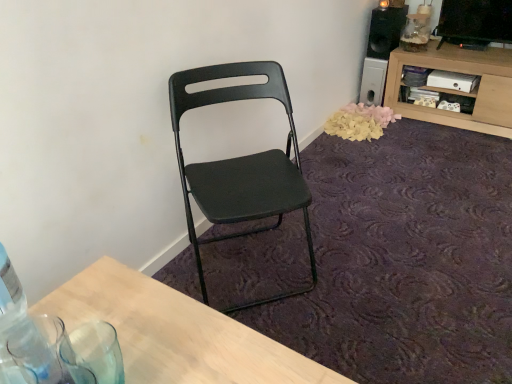
Question: From the image's perspective, is yellow paper petals at lower right located above or below wooden cabinet at upper right?

Choices:
 (A) below
 (B) above

Answer: (A)

Question: From a real-world perspective, is yellow paper petals at lower right above or below wooden cabinet at upper right?

Choices:
 (A) below
 (B) above

Answer: (A)

Question: Considering the real-world distances, which object is farthest from the wooden cabinet at upper right?

Choices:
 (A) black matte speaker at upper right
 (B) yellow paper petals at lower right
 (C) matte black folding chair at center
 (D) clear glass bottle at lower left

Answer: (D)

Question: Which of these objects is positioned farthest from the matte black folding chair at center?

Choices:
 (A) clear glass bottle at lower left
 (B) wooden cabinet at upper right
 (C) yellow paper petals at lower right
 (D) black matte speaker at upper right

Answer: (D)